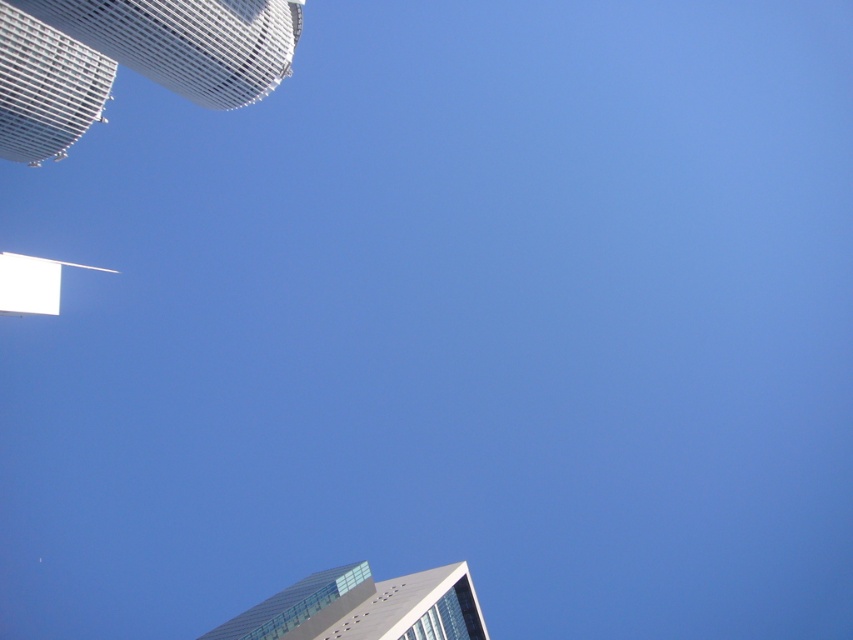
You are standing on the street below and want to take a photo of both the white mesh tower at upper left and the glassy steel skyscraper at lower center. Which one will appear taller in the photo?

The white mesh tower at upper left will appear taller in the photo because it is taller than the glassy steel skyscraper at lower center.

You are standing on the street below and looking up at the white mesh tower at upper left and the glassy steel skyscraper at lower center. Which one is higher in the sky?

The white mesh tower at upper left is higher in the sky than the glassy steel skyscraper at lower center because it is positioned above it in the image.

You are standing at the base of the white mesh tower at upper left and want to take a photo of it with your smartphone. The camera on your phone can focus clearly up to 100 meters. Will you be able to capture the tower in focus without moving closer?

The white mesh tower at upper left is 121.36 meters away from the camera. Since your phone can only focus up to 100 meters, you will not be able to capture the tower in focus without moving closer.